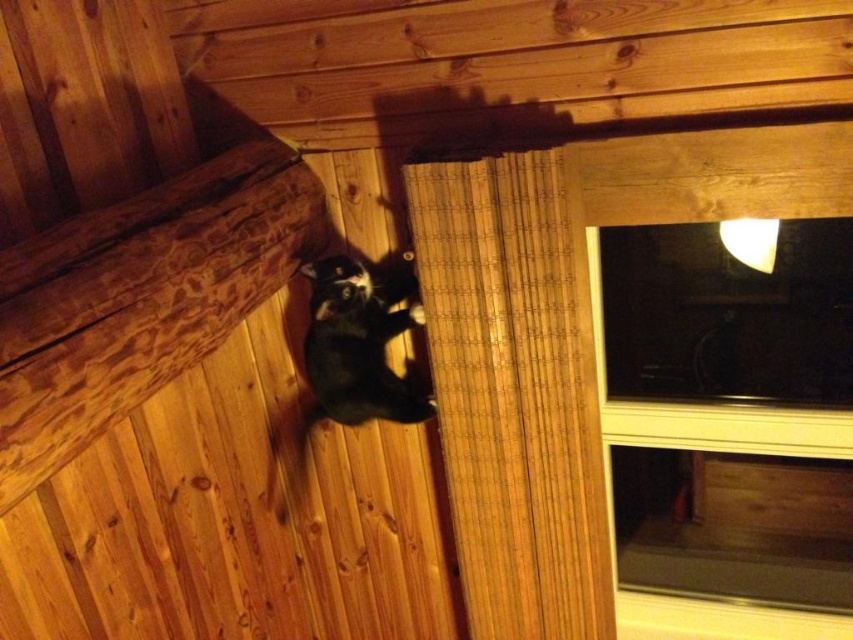
Does point (666, 529) come closer to viewer compared to point (351, 404)?

No.

Who is positioned more to the left, transparent glass window at upper right or black fur cat at center?

Positioned to the left is black fur cat at center.

Which is behind, point (752, 568) or point (374, 385)?

Positioned behind is point (752, 568).

Image resolution: width=853 pixels, height=640 pixels. Identify the location of transparent glass window at upper right. (729, 412).

Does transparent glass window at upper right appear on the right side of bamboo curtain at upper center?

Yes, transparent glass window at upper right is to the right of bamboo curtain at upper center.

Where is `transparent glass window at upper right`? transparent glass window at upper right is located at coordinates (729, 412).

I want to click on transparent glass window at upper right, so click(x=729, y=412).

Which is below, bamboo curtain at upper center or black fur cat at center?

bamboo curtain at upper center is below.

Does bamboo curtain at upper center have a lesser width compared to black fur cat at center?

In fact, bamboo curtain at upper center might be wider than black fur cat at center.

You are a GUI agent. You are given a task and a screenshot of the screen. Output one action in this format:
    pyautogui.click(x=<x>, y=<y>)
    Task: Click on the bamboo curtain at upper center
    This screenshot has width=853, height=640.
    Given the screenshot: What is the action you would take?
    click(515, 388)

What are the coordinates of `bamboo curtain at upper center` in the screenshot? It's located at (515, 388).